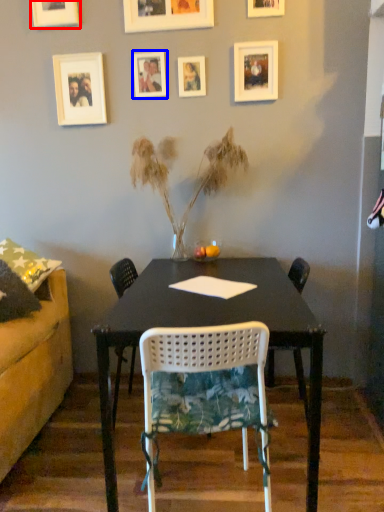
Question: Which object appears farthest to the camera in this image, picture frame (highlighted by a red box) or picture frame (highlighted by a blue box)?

Choices:
 (A) picture frame
 (B) picture frame

Answer: (B)